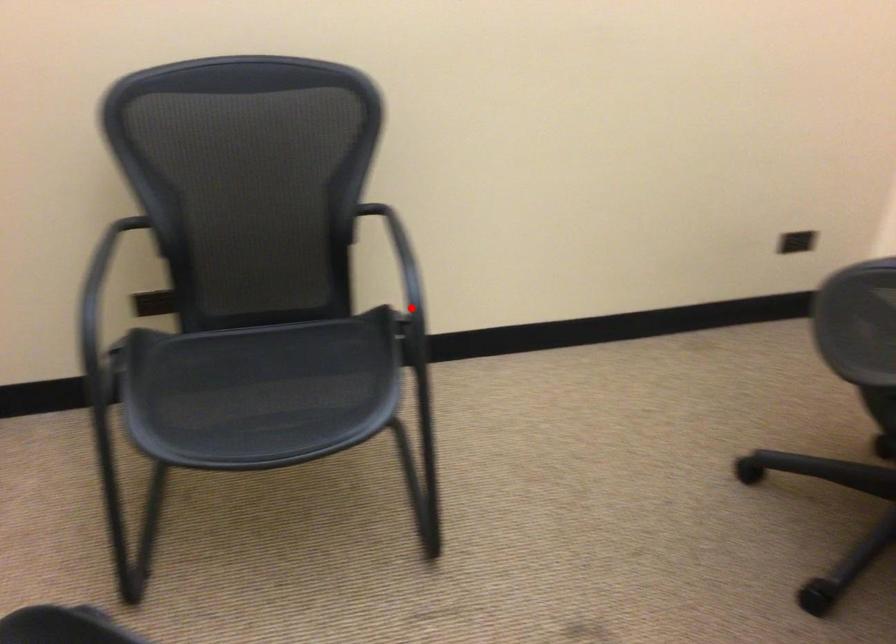
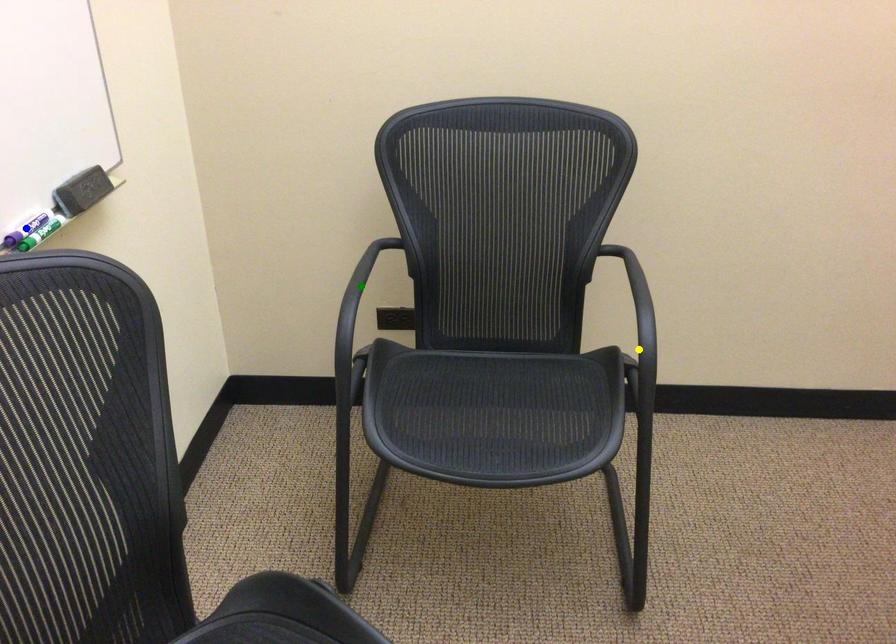
Question: I am providing you with two images of the same scene from different viewpoints. A red point is marked on the first image. You are given multiple points on the second image. Which point in image 2 represents the same 3d spot as the red point in image 1?

Choices:
 (A) blue point
 (B) green point
 (C) yellow point

Answer: (C)